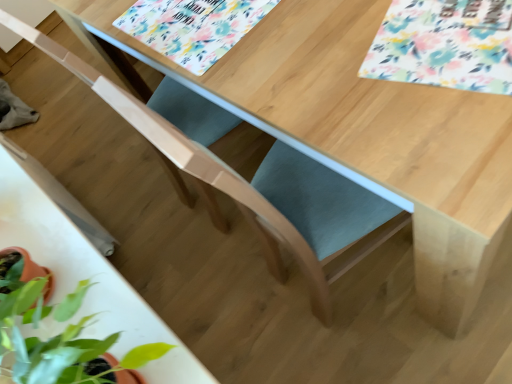
Question: Is floral-patterned paper at upper right, the 2th flower from the back, placed right next to floral-patterned placemat at upper center, which appears as the first flower when viewed from the back?

Choices:
 (A) no
 (B) yes

Answer: (A)

Question: Is floral-patterned paper at upper right, the 2th flower positioned from the left, shorter than floral-patterned placemat at upper center, placed as the 2th flower when sorted from front to back?

Choices:
 (A) yes
 (B) no

Answer: (A)

Question: Considering the relative sizes of floral-patterned paper at upper right, positioned as the first flower in front-to-back order, and floral-patterned placemat at upper center, placed as the 2th flower when sorted from front to back, in the image provided, is floral-patterned paper at upper right, positioned as the first flower in front-to-back order, thinner than floral-patterned placemat at upper center, placed as the 2th flower when sorted from front to back,?

Choices:
 (A) no
 (B) yes

Answer: (A)

Question: Is floral-patterned paper at upper right, positioned as the first flower in front-to-back order, not within floral-patterned placemat at upper center, placed as the 2th flower when sorted from front to back?

Choices:
 (A) yes
 (B) no

Answer: (A)

Question: Is floral-patterned paper at upper right, the 2th flower positioned from the left, facing towards floral-patterned placemat at upper center, which appears as the first flower when viewed from the left?

Choices:
 (A) yes
 (B) no

Answer: (B)

Question: Which is correct: white glossy round table at center is inside floral-patterned paper at upper right, positioned as the first flower in front-to-back order, or outside of it?

Choices:
 (A) outside
 (B) inside

Answer: (A)

Question: Is white glossy round table at center in front of or behind floral-patterned paper at upper right, the 2th flower from the back, in the image?

Choices:
 (A) behind
 (B) front

Answer: (B)

Question: In terms of width, does white glossy round table at center look wider or thinner when compared to floral-patterned paper at upper right, the first flower from the right?

Choices:
 (A) thin
 (B) wide

Answer: (A)

Question: Is white glossy round table at center bigger or smaller than floral-patterned paper at upper right, the 2th flower from the back?

Choices:
 (A) big
 (B) small

Answer: (A)

Question: Is point (165, 46) closer or farther from the camera than point (143, 301)?

Choices:
 (A) farther
 (B) closer

Answer: (B)

Question: In terms of height, does floral-patterned placemat at upper center, placed as the 2th flower when sorted from front to back, look taller or shorter compared to white glossy round table at center?

Choices:
 (A) tall
 (B) short

Answer: (B)

Question: In the image, is floral-patterned placemat at upper center, which appears as the 2th flower when viewed from the right, on the left side or the right side of white glossy round table at center?

Choices:
 (A) right
 (B) left

Answer: (A)

Question: Looking at their shapes, would you say floral-patterned placemat at upper center, which appears as the first flower when viewed from the back, is wider or thinner than white glossy round table at center?

Choices:
 (A) wide
 (B) thin

Answer: (A)

Question: Visually, is floral-patterned placemat at upper center, which appears as the first flower when viewed from the back, positioned to the left or to the right of floral-patterned paper at upper right, the 2th flower from the back?

Choices:
 (A) right
 (B) left

Answer: (B)

Question: Considering the positions of point (139, 18) and point (455, 14), is point (139, 18) closer or farther from the camera than point (455, 14)?

Choices:
 (A) closer
 (B) farther

Answer: (B)